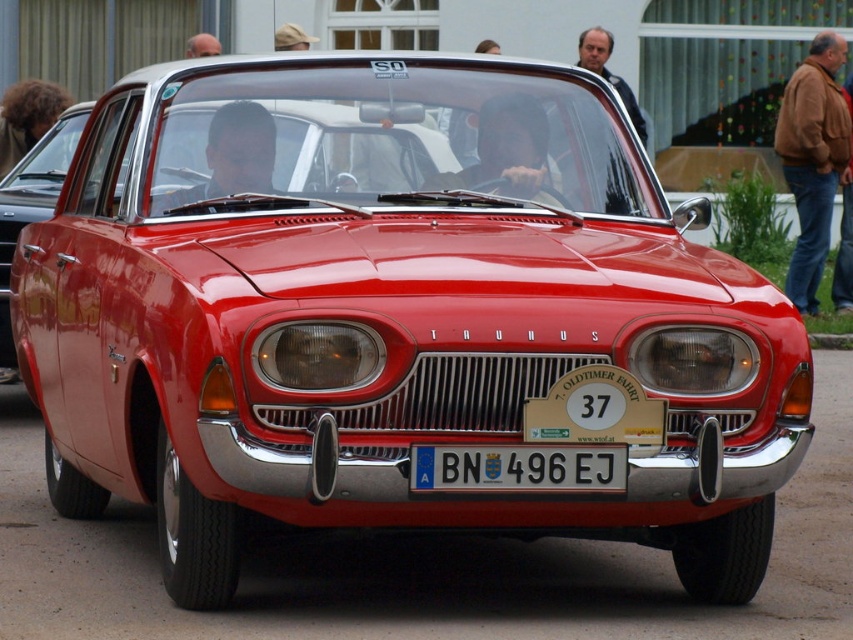
You are a photographer taking a closeup shot of the black plastic license plate at center and the shiny red car at center. Which object will appear larger in your photo?

The shiny red car at center will appear larger in the photo because it occupies more space than the black plastic license plate at center.

You are standing in front of the vintage Triumph car. There is a point marked at coordinates [518,468]. What object is located at this point?

The point at [518,468] marks the black plastic license plate at center.

You are a photographer taking a picture of the shiny red car at center. You notice the black plastic license plate at center in the frame. Which object appears taller in the photo?

The shiny red car at center appears taller than the black plastic license plate at center because the black plastic license plate at center has a lesser height compared to shiny red car at center.